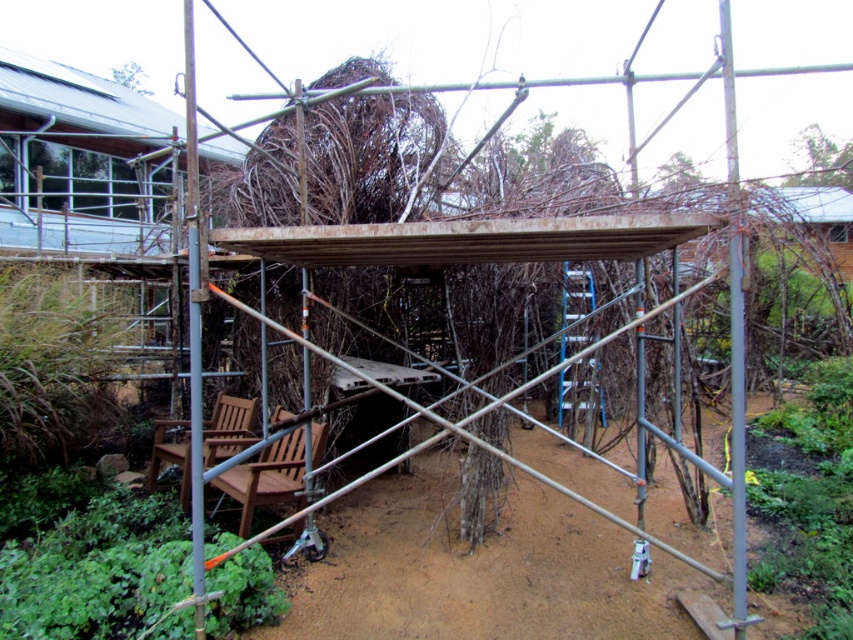
Is the position of wooden chair at center less distant than that of wooden chair at lower left?

That is True.

Which is below, wooden chair at center or wooden chair at lower left?

wooden chair at center is below.

At what (x,y) coordinates should I click in order to perform the action: click on wooden chair at center. Please return your answer as a coordinate pair (x, y). Looking at the image, I should click on (265, 477).

Locate an element on the screen. wooden chair at center is located at coordinates (265, 477).